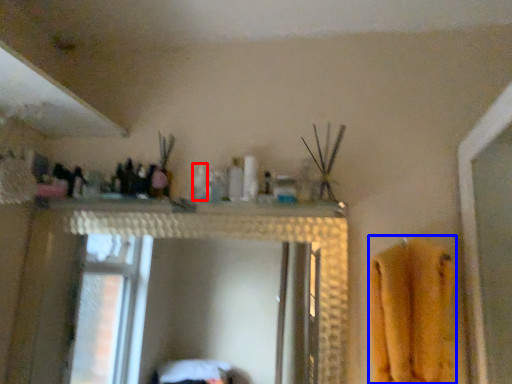
Question: Which object appears farthest to the camera in this image, toiletry (highlighted by a red box) or bath towel (highlighted by a blue box)?

Choices:
 (A) toiletry
 (B) bath towel

Answer: (A)